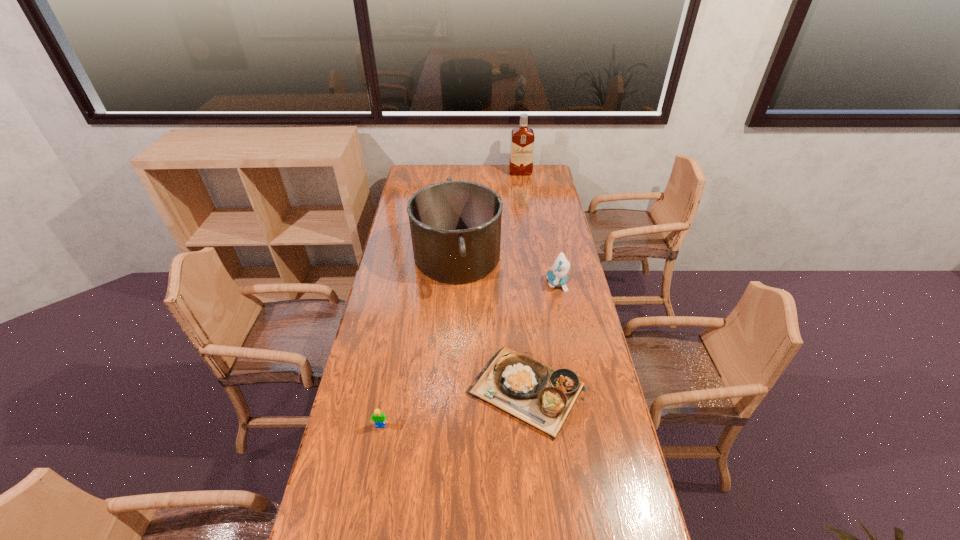
You are a GUI agent. You are given a task and a screenshot of the screen. Output one action in this format:
    pyautogui.click(x=<x>, y=<y>)
    Task: Click on the vacant area at the far edge of the desktop
    The height and width of the screenshot is (540, 960).
    Given the screenshot: What is the action you would take?
    pyautogui.click(x=489, y=184)

In the image, there is a desktop. At what (x,y) coordinates should I click in order to perform the action: click on blank space at the left edge. Please return your answer as a coordinate pair (x, y). Looking at the image, I should click on (384, 452).

Where is `vacant space at the right edge of the desktop`? The image size is (960, 540). vacant space at the right edge of the desktop is located at coordinates (586, 296).

At what (x,y) coordinates should I click in order to perform the action: click on vacant space at the far left corner of the desktop. Please return your answer as a coordinate pair (x, y). Looking at the image, I should click on (418, 174).

This screenshot has width=960, height=540. I want to click on free space at the far right corner, so click(x=534, y=180).

This screenshot has height=540, width=960. In order to click on unoccupied position between the pan and the kitten in this screenshot , I will do `click(507, 270)`.

This screenshot has width=960, height=540. I want to click on free space between the fourth shortest object and the second shortest object, so click(419, 341).

Locate an element on the screen. vacant space in between the kitten and the pan is located at coordinates (507, 270).

Locate an element on the screen. The height and width of the screenshot is (540, 960). free point between the third shortest object and the platter is located at coordinates (542, 338).

This screenshot has height=540, width=960. I want to click on free spot between the farthest object and the second shortest object, so [450, 300].